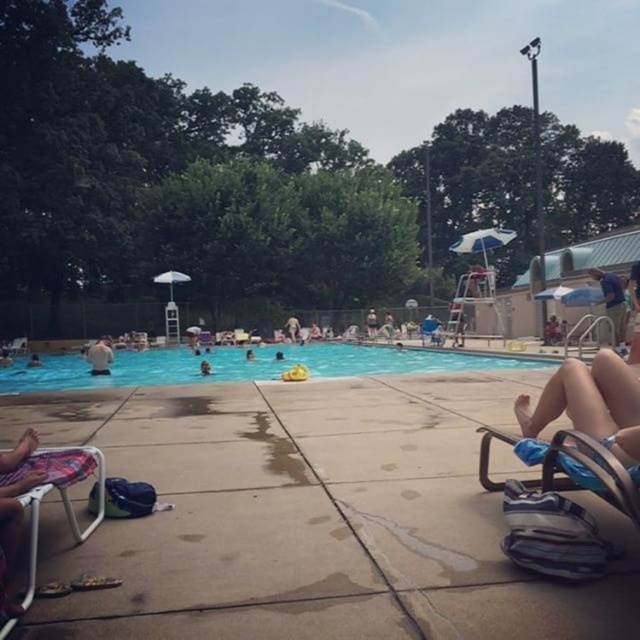
Between tan skin at lower right and metallic silver beach chair at lower right, which one appears on the right side from the viewer's perspective?

Positioned to the right is tan skin at lower right.

Which of these two, tan skin at lower right or metallic silver beach chair at lower right, stands taller?

Standing taller between the two is metallic silver beach chair at lower right.

The width and height of the screenshot is (640, 640). I want to click on tan skin at lower right, so click(589, 403).

Which of these two, blue smooth water at center or blue fabric shorts at right, stands taller?

With more height is blue fabric shorts at right.

Between point (372, 348) and point (621, 324), which one is positioned in front?

Point (621, 324) is in front.

Who is more forward, (x=337, y=356) or (x=609, y=284)?

Point (x=609, y=284) is more forward.

Identify the location of blue smooth water at center. The image size is (640, 640). (248, 365).

Who is positioned more to the left, white matte shirt at upper left or dark blue swimmer at center?

dark blue swimmer at center

Is white matte shirt at upper left to the left of dark blue swimmer at center from the viewer's perspective?

In fact, white matte shirt at upper left is to the right of dark blue swimmer at center.

Does point (90, 369) come closer to viewer compared to point (36, 356)?

Yes, point (90, 369) is in front of point (36, 356).

Where is `white matte shirt at upper left`? The width and height of the screenshot is (640, 640). white matte shirt at upper left is located at coordinates (99, 356).